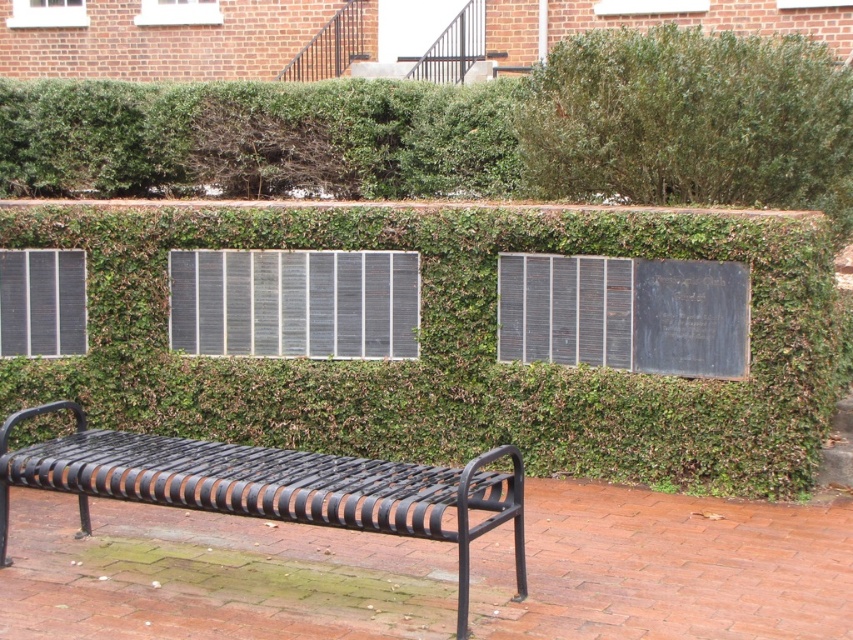
Question: Does green leafy hedge at upper right have a lesser width compared to metallic grid at center?

Choices:
 (A) yes
 (B) no

Answer: (B)

Question: Is green leafy hedge at upper right bigger than black metal bench at lower left?

Choices:
 (A) yes
 (B) no

Answer: (A)

Question: Estimate the real-world distances between objects in this image. Which object is farther from the green leafy hedge at center?

Choices:
 (A) green leafy hedge at upper right
 (B) metallic silver plaque at center
 (C) metallic grid at center
 (D) green leafy hedge at upper center

Answer: (D)

Question: Which point appears closest to the camera in this image?

Choices:
 (A) (265, 269)
 (B) (556, 385)

Answer: (B)

Question: Considering the real-world distances, which object is closest to the metallic grid panel at left?

Choices:
 (A) green leafy hedge at upper right
 (B) green leafy hedge at upper center

Answer: (B)

Question: Does green leafy hedge at upper right have a smaller size compared to metallic silver plaque at center?

Choices:
 (A) no
 (B) yes

Answer: (A)